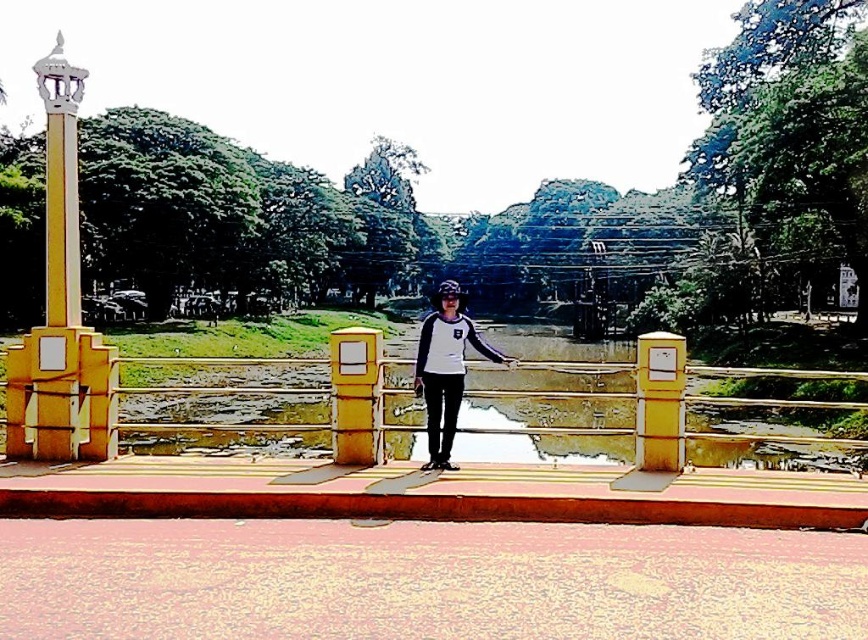
You are standing on the bridge and notice a point at coordinates (61, 184). Based on the scene, what object is this point located on?

The point at coordinates (61, 184) is located on the yellow polished stone column at left.